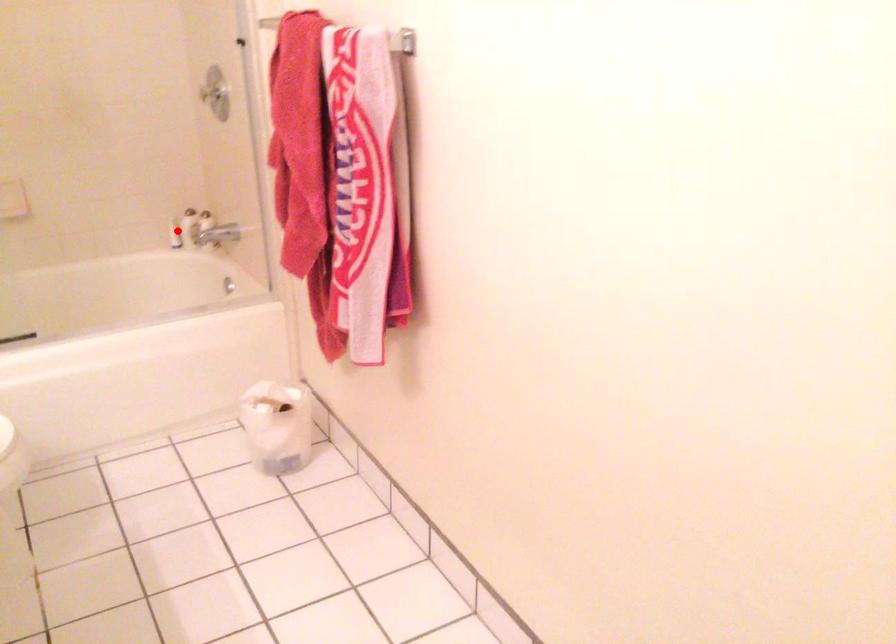
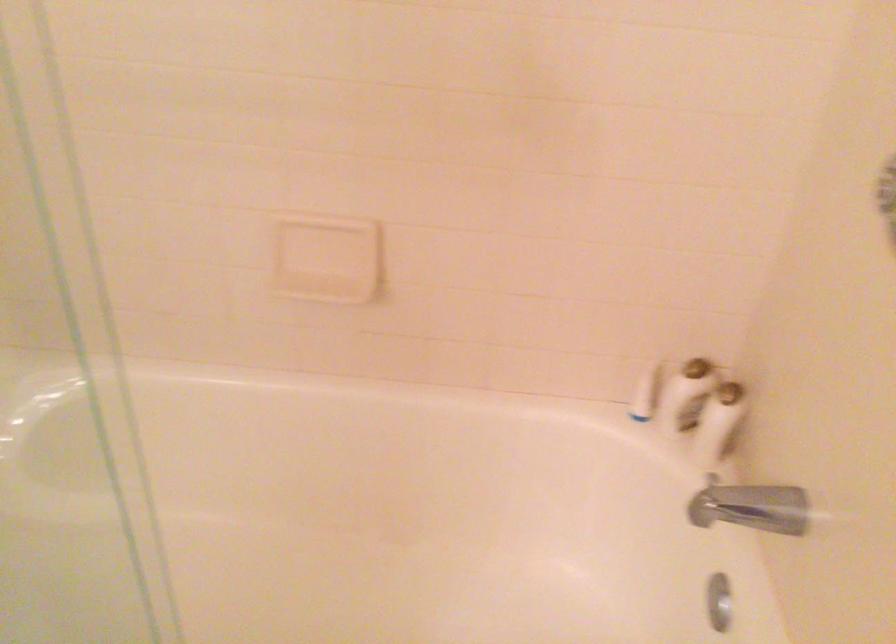
Question: I am providing you with two images of the same scene from different viewpoints. A red point is shown in image1. For the corresponding object point in image2, is it positioned nearer or farther from the camera?

Choices:
 (A) Nearer
 (B) Farther

Answer: (A)